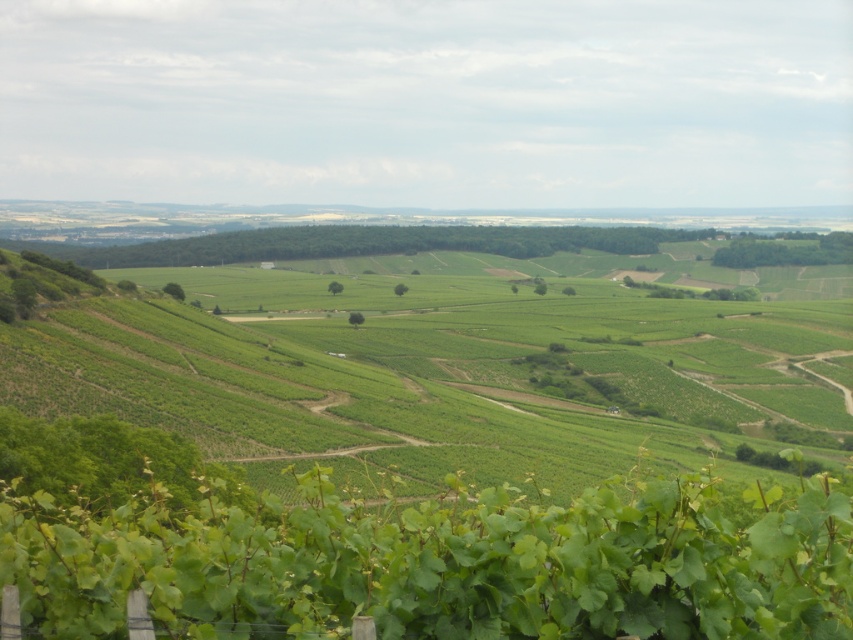
Is green leafy vines at lower center above green leafy vine at lower center?

Correct, green leafy vines at lower center is located above green leafy vine at lower center.

Does point (148, 310) come farther from viewer compared to point (108, 518)?

Yes.

This screenshot has height=640, width=853. Find the location of `green leafy vines at lower center`. green leafy vines at lower center is located at coordinates (444, 353).